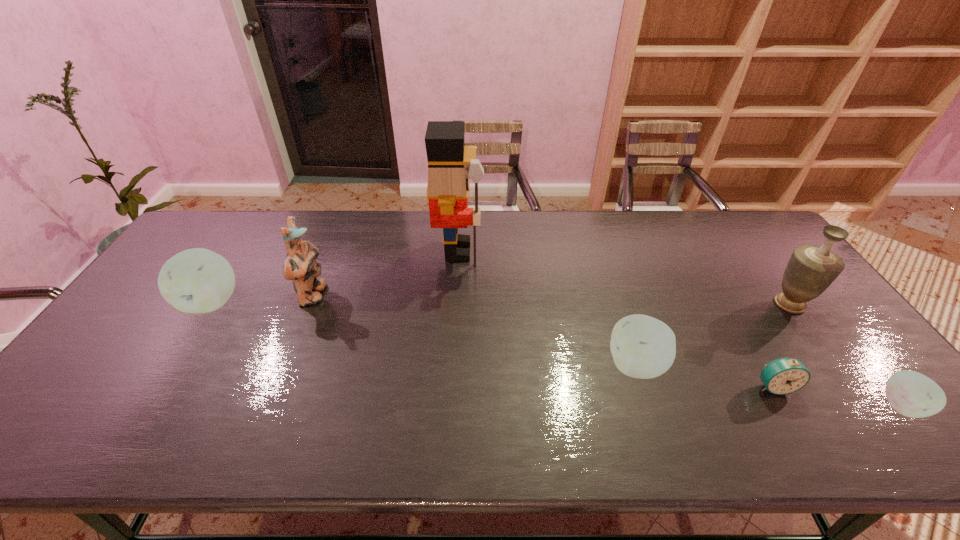
In order to click on vacant space that's between the tallest object and the shortest apple in this screenshot , I will do `click(679, 328)`.

At what (x,y) coordinates should I click in order to perform the action: click on free space between the urn and the leftmost object. Please return your answer as a coordinate pair (x, y). This screenshot has width=960, height=540. Looking at the image, I should click on (501, 303).

The height and width of the screenshot is (540, 960). I want to click on free space that is in between the urn and the third shortest object, so click(x=713, y=335).

This screenshot has height=540, width=960. What are the coordinates of `free point between the fourth object from right to left and the alarm clock` in the screenshot? It's located at (705, 376).

Identify the location of vacant region between the fifth object from right to left and the farthest apple. (335, 276).

Where is `free point between the farthest apple and the fourth object from left to right`? The image size is (960, 540). free point between the farthest apple and the fourth object from left to right is located at coordinates (424, 334).

At what (x,y) coordinates should I click in order to perform the action: click on vacant area between the urn and the alarm clock. Please return your answer as a coordinate pair (x, y). This screenshot has height=540, width=960. Looking at the image, I should click on (781, 345).

Locate an element on the screen. free space between the leftmost object and the alarm clock is located at coordinates (493, 344).

Identify the location of object that is the sixth nearest to the nutcracker. The width and height of the screenshot is (960, 540). (912, 394).

I want to click on object that stands as the third closest to the shortest apple, so 644,347.